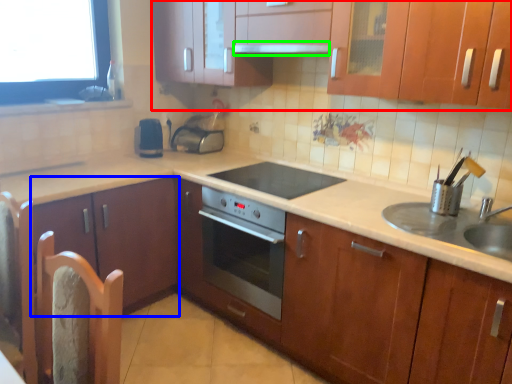
Question: Based on their relative distances, which object is nearer to cabinetry (highlighted by a red box)? Choose from cabinetry (highlighted by a blue box) and exhaust hood (highlighted by a green box).

Choices:
 (A) cabinetry
 (B) exhaust hood

Answer: (B)